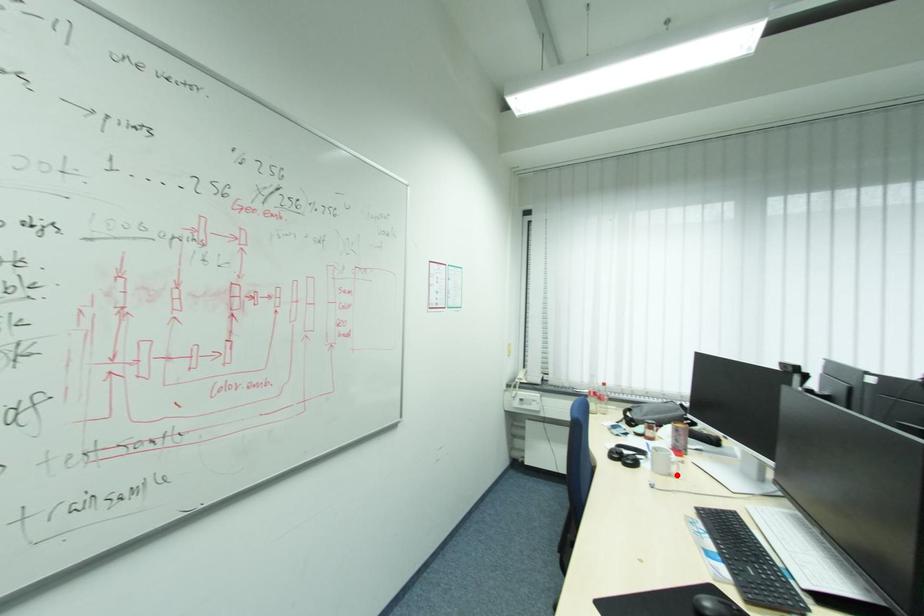
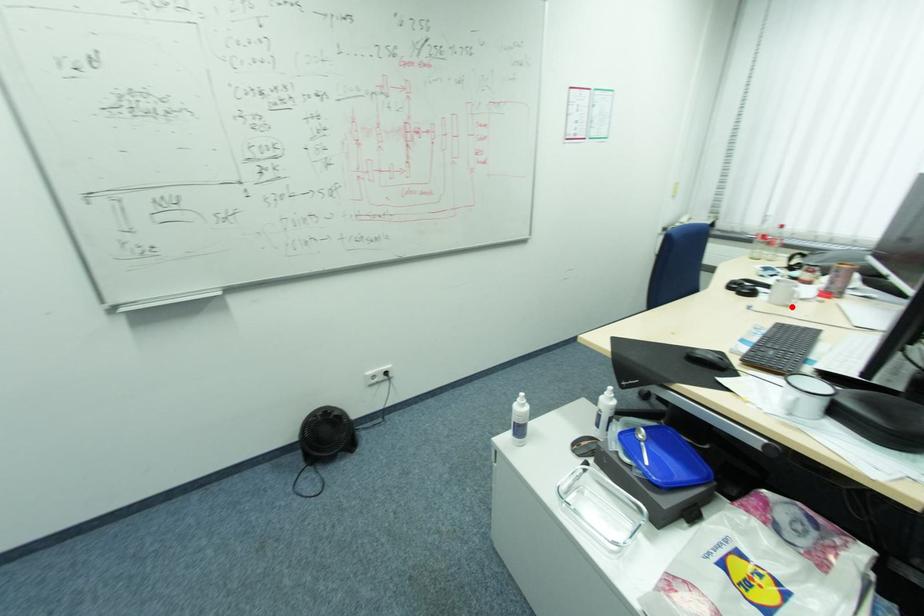
I am providing you with two images of the same scene from different viewpoints. A red point is marked on the first image and another point is marked on the second image. Does the point marked in image1 correspond to the same location as the one in image2?

Yes